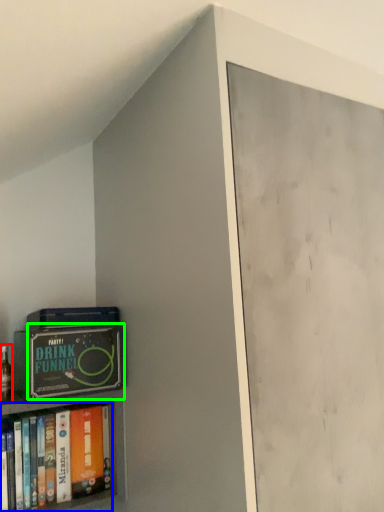
Question: Which is farther away from alcohol (highlighted by a red box)? book (highlighted by a blue box) or paperback book (highlighted by a green box)?

Choices:
 (A) book
 (B) paperback book

Answer: (B)